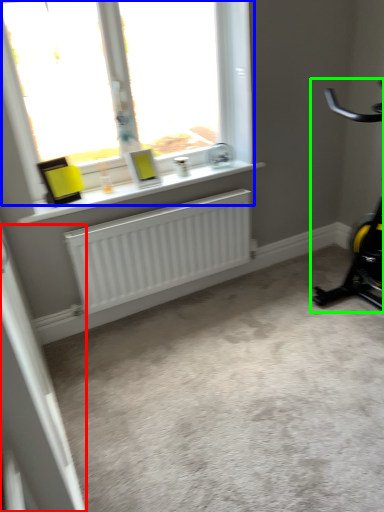
Question: Based on their relative distances, which object is nearer to screen door (highlighted by a red box)? Choose from window (highlighted by a blue box) and stationary bicycle (highlighted by a green box).

Choices:
 (A) window
 (B) stationary bicycle

Answer: (A)